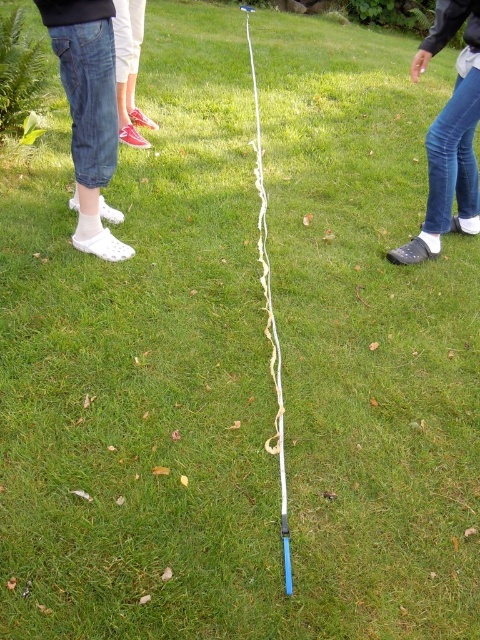
Can you confirm if white fabric socks at left is smaller than blue denim jeans at lower right?

Yes.

At what (x,y) coordinates should I click in order to perform the action: click on white fabric socks at left. Please return your answer as a coordinate pair (x, y). Looking at the image, I should click on (88, 113).

Where is `white fabric socks at left`? The width and height of the screenshot is (480, 640). white fabric socks at left is located at coordinates (88, 113).

Which is more to the left, white fabric string at center or pink fabric shoe at upper left?

pink fabric shoe at upper left

Is white fabric string at center bigger than pink fabric shoe at upper left?

No, white fabric string at center is not bigger than pink fabric shoe at upper left.

Who is more forward, [266,292] or [112,20]?

Point [266,292] is in front.

Where is `white fabric string at center`? Image resolution: width=480 pixels, height=640 pixels. white fabric string at center is located at coordinates (269, 323).

Between white fabric socks at left and pink fabric shoe at upper left, which one appears on the right side from the viewer's perspective?

Positioned to the right is pink fabric shoe at upper left.

Between point (90, 29) and point (119, 10), which one is positioned in front?

Point (90, 29)

Which is in front, point (86, 122) or point (133, 68)?

Point (86, 122) is in front.

Find the location of `white fabric socks at left`. white fabric socks at left is located at coordinates (88, 113).